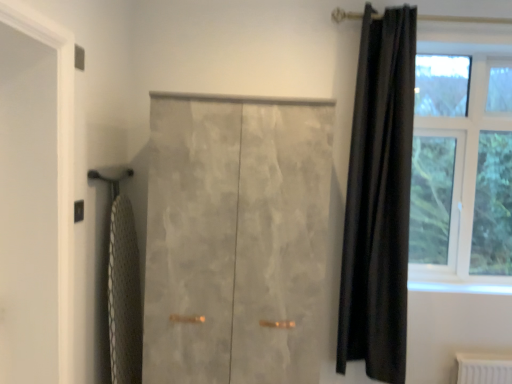
Describe the element at coordinates (379, 199) in the screenshot. Image resolution: width=512 pixels, height=384 pixels. I see `black velvet curtain at right` at that location.

In order to face white matte screen door at left, should I rotate leftwards or rightwards?

A 30.375 degree turn to the left will do.

Measure the distance between point (x=133, y=348) and camera.

Point (x=133, y=348) is 2.12 meters away from camera.

Measure the distance between white mesh bath towel at left and camera.

A distance of 6.40 feet exists between white mesh bath towel at left and camera.

Find the location of a particular element. This screenshot has width=512, height=384. satin gray wardrobe at center is located at coordinates (236, 239).

Considering the sizes of objects clear glass window at upper right and satin gray wardrobe at center in the image provided, who is smaller, clear glass window at upper right or satin gray wardrobe at center?

clear glass window at upper right is smaller.

Is clear glass window at upper right positioned beyond the bounds of satin gray wardrobe at center?

Yes.

Is clear glass window at upper right positioned far away from satin gray wardrobe at center?

Yes, clear glass window at upper right and satin gray wardrobe at center are quite far apart.

From the image's perspective, who appears lower, clear glass window at upper right or satin gray wardrobe at center?

satin gray wardrobe at center appears lower in the image.

Is white mesh bath towel at left turned away from white matte screen door at left?

That's not correct — white mesh bath towel at left is not looking away from white matte screen door at left.

From a real-world perspective, who is located lower, white mesh bath towel at left or white matte screen door at left?

white mesh bath towel at left.

Considering the positions of points (117, 218) and (33, 336), is point (117, 218) closer to camera compared to point (33, 336)?

No, (117, 218) is further to viewer.

Which of these two, white mesh bath towel at left or white matte screen door at left, is bigger?

white matte screen door at left is bigger.

Between point (443, 144) and point (127, 262), which one is positioned in front?

The point (127, 262) is in front.

Considering the relative sizes of clear glass window at upper right and white mesh bath towel at left in the image provided, is clear glass window at upper right smaller than white mesh bath towel at left?

No, clear glass window at upper right is not smaller than white mesh bath towel at left.

Is clear glass window at upper right facing away from white mesh bath towel at left?

No.

Which object is closer to the camera taking this photo, black velvet curtain at right or clear glass window at upper right?

black velvet curtain at right.

From the picture: From the image's perspective, is black velvet curtain at right located above or below clear glass window at upper right?

Based on their image positions, black velvet curtain at right is located beneath clear glass window at upper right.

Does black velvet curtain at right have a lesser width compared to clear glass window at upper right?

Yes.

Is black velvet curtain at right inside the boundaries of clear glass window at upper right, or outside?

The correct answer is: outside.

Is point (116, 261) farther from viewer compared to point (166, 282)?

Yes, point (116, 261) is behind point (166, 282).

Considering the positions of objects white mesh bath towel at left and satin gray wardrobe at center in the image provided, who is behind, white mesh bath towel at left or satin gray wardrobe at center?

Positioned behind is white mesh bath towel at left.

Are white mesh bath towel at left and satin gray wardrobe at center located far from each other?

That's not correct — white mesh bath towel at left is a little close to satin gray wardrobe at center.

Is white mesh bath towel at left positioned with its back to satin gray wardrobe at center?

Absolutely, white mesh bath towel at left is directed away from satin gray wardrobe at center.

From the image's perspective, between black velvet curtain at right and white matte screen door at left, who is located below?

white matte screen door at left, from the image's perspective.

Considering the positions of objects black velvet curtain at right and white matte screen door at left in the image provided, who is behind, black velvet curtain at right or white matte screen door at left?

black velvet curtain at right is further from the camera.

Is white matte screen door at left a part of black velvet curtain at right?

Definitely not — white matte screen door at left is not inside black velvet curtain at right.

From a real-world perspective, between black velvet curtain at right and white matte screen door at left, who is vertically lower?

white matte screen door at left is physically lower.

Does point (130, 248) appear closer or farther from the camera than point (479, 153)?

Point (130, 248).

Looking at their sizes, would you say white mesh bath towel at left is wider or thinner than clear glass window at upper right?

white mesh bath towel at left is thinner than clear glass window at upper right.

Considering the sizes of objects white mesh bath towel at left and clear glass window at upper right in the image provided, who is shorter, white mesh bath towel at left or clear glass window at upper right?

Standing shorter between the two is white mesh bath towel at left.

From the image's perspective, is white mesh bath towel at left located above clear glass window at upper right?

No, from the image's perspective, white mesh bath towel at left is not on top of clear glass window at upper right.

The height and width of the screenshot is (384, 512). Identify the location of window above the satin gray wardrobe at center (from the image's perspective). (462, 169).

You are a GUI agent. You are given a task and a screenshot of the screen. Output one action in this format:
    pyautogui.click(x=<x>, y=<y>)
    Task: Click on the screen door located on the left of white mesh bath towel at left
    
    Given the screenshot: What is the action you would take?
    pyautogui.click(x=28, y=209)

Considering their positions, is clear glass window at upper right positioned further to black velvet curtain at right than white matte screen door at left?

The object further to black velvet curtain at right is white matte screen door at left.

Based on their spatial positions, is black velvet curtain at right or white matte screen door at left further from white mesh bath towel at left?

black velvet curtain at right lies further to white mesh bath towel at left than the other object.

When comparing their distances from satin gray wardrobe at center, does clear glass window at upper right or white mesh bath towel at left seem closer?

Based on the image, white mesh bath towel at left appears to be nearer to satin gray wardrobe at center.

When comparing their distances from satin gray wardrobe at center, does white mesh bath towel at left or clear glass window at upper right seem further?

Based on the image, clear glass window at upper right appears to be further to satin gray wardrobe at center.

Looking at this image, which object lies further to the anchor point clear glass window at upper right, satin gray wardrobe at center or white matte screen door at left?

Based on the image, white matte screen door at left appears to be further to clear glass window at upper right.

Based on the photo, when comparing their distances from black velvet curtain at right, does white mesh bath towel at left or white matte screen door at left seem closer?

white mesh bath towel at left lies closer to black velvet curtain at right than the other object.

Based on their spatial positions, is black velvet curtain at right or satin gray wardrobe at center further from clear glass window at upper right?

satin gray wardrobe at center lies further to clear glass window at upper right than the other object.

Which object lies nearer to the anchor point satin gray wardrobe at center, white mesh bath towel at left or black velvet curtain at right?

white mesh bath towel at left.

I want to click on curtain between white matte screen door at left and clear glass window at upper right, so click(x=379, y=199).

You are a GUI agent. You are given a task and a screenshot of the screen. Output one action in this format:
    pyautogui.click(x=<x>, y=<y>)
    Task: Click on the door between white mesh bath towel at left and black velvet curtain at right in the horizontal direction
    
    Given the screenshot: What is the action you would take?
    pyautogui.click(x=236, y=239)

At what (x,y) coordinates should I click in order to perform the action: click on door between white matte screen door at left and clear glass window at upper right in the horizontal direction. Please return your answer as a coordinate pair (x, y). Looking at the image, I should click on (236, 239).

You are a GUI agent. You are given a task and a screenshot of the screen. Output one action in this format:
    pyautogui.click(x=<x>, y=<y>)
    Task: Click on the bath towel located between white matte screen door at left and clear glass window at upper right in the left-right direction
    
    Given the screenshot: What is the action you would take?
    pyautogui.click(x=124, y=295)